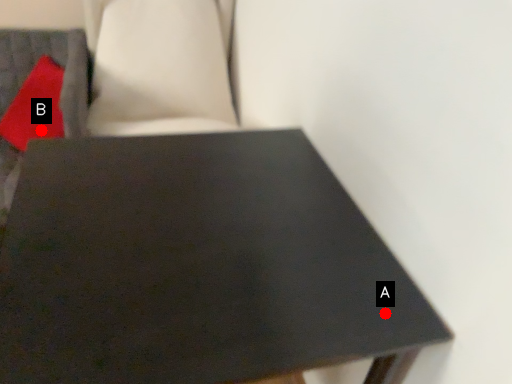
Question: Two points are circled on the image, labeled by A and B beside each circle. Among these points, which one is nearest to the camera?

Choices:
 (A) A is closer
 (B) B is closer

Answer: (A)